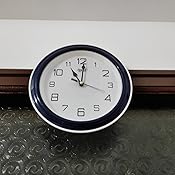
This screenshot has height=175, width=175. Find the location of `white wall`. white wall is located at coordinates (138, 30).